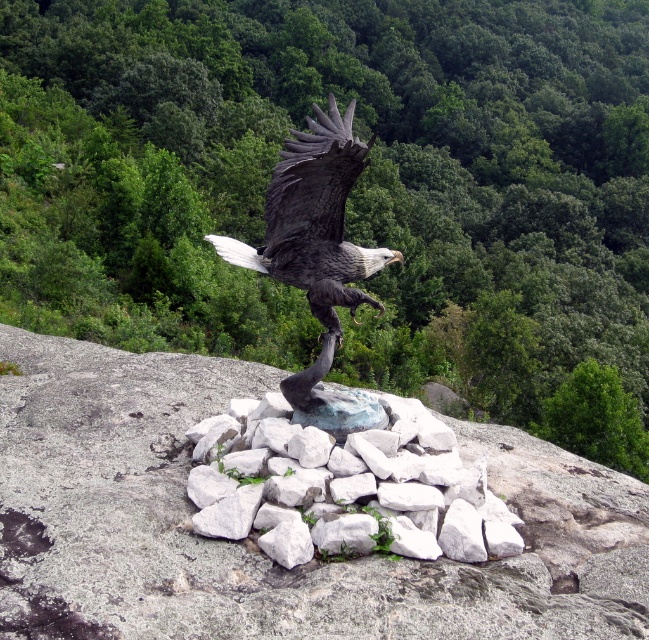
Looking at this image, can you confirm if white stone at center is positioned below shiny black eagle at center?

Indeed, white stone at center is positioned under shiny black eagle at center.

Does white stone at center have a greater width compared to shiny black eagle at center?

In fact, white stone at center might be narrower than shiny black eagle at center.

Is point (337, 493) positioned before point (337, 166)?

That is True.

Locate an element on the screen. white stone at center is located at coordinates (349, 486).